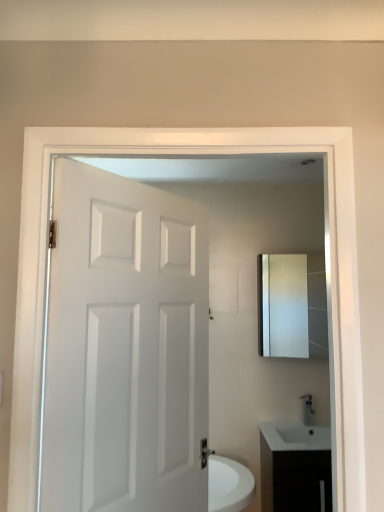
Find the location of `satin nickel faucet at lower right`. satin nickel faucet at lower right is located at coordinates (308, 410).

From the image's perspective, is white glossy cabinet at lower right above or below matte silver medicine cabinet at upper right?

white glossy cabinet at lower right is situated lower than matte silver medicine cabinet at upper right in the image.

This screenshot has height=512, width=384. What are the coordinates of `bathroom cabinet that appears in front of the matte silver medicine cabinet at upper right` in the screenshot? It's located at (294, 467).

Is white glossy cabinet at lower right turned away from matte silver medicine cabinet at upper right?

white glossy cabinet at lower right does not have its back to matte silver medicine cabinet at upper right.

Is satin nickel faucet at lower right at the right side of matte silver medicine cabinet at upper right?

Indeed, satin nickel faucet at lower right is positioned on the right side of matte silver medicine cabinet at upper right.

Based on their sizes in the image, would you say satin nickel faucet at lower right is bigger or smaller than matte silver medicine cabinet at upper right?

satin nickel faucet at lower right is smaller than matte silver medicine cabinet at upper right.

Is matte silver medicine cabinet at upper right at the back of satin nickel faucet at lower right?

No, satin nickel faucet at lower right is not facing away from matte silver medicine cabinet at upper right.

Image resolution: width=384 pixels, height=512 pixels. What are the coordinates of `medicine cabinet above the satin nickel faucet at lower right (from a real-world perspective)` in the screenshot? It's located at (283, 305).

From the image's perspective, is matte silver medicine cabinet at upper right above or below white matte door at center?

Clearly, from the image's perspective, matte silver medicine cabinet at upper right is above white matte door at center.

Considering the points (267, 291) and (73, 423), which point is in front, point (267, 291) or point (73, 423)?

Positioned in front is point (73, 423).

Considering the sizes of objects matte silver medicine cabinet at upper right and white matte door at center in the image provided, who is thinner, matte silver medicine cabinet at upper right or white matte door at center?

matte silver medicine cabinet at upper right.

Between satin nickel faucet at lower right and white matte door at center, which one has smaller size?

satin nickel faucet at lower right is smaller.

Consider the image. Which object is wider, satin nickel faucet at lower right or white matte door at center?

With larger width is white matte door at center.

Considering the positions of objects satin nickel faucet at lower right and white matte door at center in the image provided, who is behind, satin nickel faucet at lower right or white matte door at center?

satin nickel faucet at lower right is more distant.

From the picture: Considering the sizes of objects white matte door at center and satin nickel faucet at lower right in the image provided, who is smaller, white matte door at center or satin nickel faucet at lower right?

satin nickel faucet at lower right is smaller.

Can you confirm if white matte door at center is taller than satin nickel faucet at lower right?

Indeed, white matte door at center has a greater height compared to satin nickel faucet at lower right.

Could satin nickel faucet at lower right be considered to be inside white matte door at center?

No, satin nickel faucet at lower right is not a part of white matte door at center.

From the image's perspective, relative to satin nickel faucet at lower right, is white matte door at center above or below?

white matte door at center is situated higher than satin nickel faucet at lower right in the image.

Could you tell me if satin nickel faucet at lower right is turned towards white glossy cabinet at lower right?

No, satin nickel faucet at lower right is not turned towards white glossy cabinet at lower right.

From the image's perspective, which is below, satin nickel faucet at lower right or white glossy cabinet at lower right?

white glossy cabinet at lower right, from the image's perspective.

Considering the relative sizes of satin nickel faucet at lower right and white glossy cabinet at lower right in the image provided, is satin nickel faucet at lower right thinner than white glossy cabinet at lower right?

Indeed, satin nickel faucet at lower right has a lesser width compared to white glossy cabinet at lower right.

Between white glossy cabinet at lower right and white matte door at center, which one is positioned in front?

white matte door at center.

Is white glossy cabinet at lower right oriented towards white matte door at center?

No, white glossy cabinet at lower right is not oriented towards white matte door at center.

Is white glossy cabinet at lower right wider or thinner than white matte door at center?

white glossy cabinet at lower right is wider than white matte door at center.

In terms of size, does white glossy cabinet at lower right appear bigger or smaller than white matte door at center?

white glossy cabinet at lower right is bigger than white matte door at center.

Identify the location of medicine cabinet that appears on the right of white glossy cabinet at lower right. (283, 305).

This screenshot has height=512, width=384. There is a satin nickel faucet at lower right. What are the coordinates of `medicine cabinet above it (from a real-world perspective)` in the screenshot? It's located at (283, 305).

Based on their spatial positions, is white glossy cabinet at lower right or white matte door at center closer to satin nickel faucet at lower right?

white glossy cabinet at lower right lies closer to satin nickel faucet at lower right than the other object.

Based on their spatial positions, is white glossy cabinet at lower right or white matte door at center closer to matte silver medicine cabinet at upper right?

white glossy cabinet at lower right lies closer to matte silver medicine cabinet at upper right than the other object.

Looking at the image, which one is located closer to white glossy cabinet at lower right, satin nickel faucet at lower right or white matte door at center?

Based on the image, satin nickel faucet at lower right appears to be nearer to white glossy cabinet at lower right.

Looking at the image, which one is located further to matte silver medicine cabinet at upper right, satin nickel faucet at lower right or white matte door at center?

white matte door at center is further to matte silver medicine cabinet at upper right.

Considering their positions, is white glossy cabinet at lower right positioned further to white matte door at center than satin nickel faucet at lower right?

Based on the image, satin nickel faucet at lower right appears to be further to white matte door at center.

Considering their positions, is white matte door at center positioned closer to matte silver medicine cabinet at upper right than satin nickel faucet at lower right?

satin nickel faucet at lower right.

Estimate the real-world distances between objects in this image. Which object is further from white matte door at center, matte silver medicine cabinet at upper right or white glossy cabinet at lower right?

Based on the image, matte silver medicine cabinet at upper right appears to be further to white matte door at center.

Based on their spatial positions, is satin nickel faucet at lower right or white glossy cabinet at lower right further from white matte door at center?

Among the two, satin nickel faucet at lower right is located further to white matte door at center.

This screenshot has width=384, height=512. I want to click on tap that lies between matte silver medicine cabinet at upper right and white glossy cabinet at lower right from top to bottom, so click(x=308, y=410).

This screenshot has height=512, width=384. Identify the location of tap between white matte door at center and matte silver medicine cabinet at upper right from front to back. (308, 410).

Image resolution: width=384 pixels, height=512 pixels. In order to click on bathroom cabinet between white matte door at center and matte silver medicine cabinet at upper right in the front-back direction in this screenshot , I will do `click(294, 467)`.

Identify the location of bathroom cabinet between white matte door at center and satin nickel faucet at lower right in the front-back direction. (294, 467).